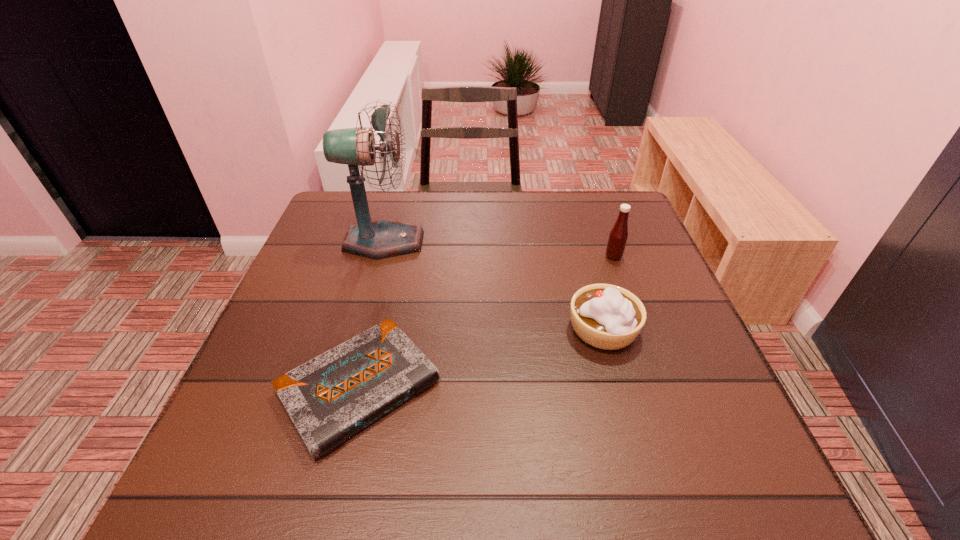
Find the location of a particular element. The height and width of the screenshot is (540, 960). vacant space that satisfies the following two spatial constraints: 1. in front of the Tabasco sauce where the wind blows; 2. on the left side of the fan is located at coordinates (380, 256).

Image resolution: width=960 pixels, height=540 pixels. Find the location of `free spot that satisfies the following two spatial constraints: 1. in front of the tallest object where the wind blows; 2. on the right side of the whipped cream`. free spot that satisfies the following two spatial constraints: 1. in front of the tallest object where the wind blows; 2. on the right side of the whipped cream is located at coordinates (360, 329).

Where is `vacant area that satisfies the following two spatial constraints: 1. in front of the tallest object where the wind blows; 2. on the left side of the third shortest object`? This screenshot has height=540, width=960. vacant area that satisfies the following two spatial constraints: 1. in front of the tallest object where the wind blows; 2. on the left side of the third shortest object is located at coordinates (380, 256).

Find the location of a particular element. This screenshot has width=960, height=540. vacant position in the image that satisfies the following two spatial constraints: 1. in front of the second tallest object where the wind blows; 2. on the left side of the tallest object is located at coordinates (380, 256).

The width and height of the screenshot is (960, 540). I want to click on vacant point that satisfies the following two spatial constraints: 1. in front of the fan where the wind blows; 2. on the right side of the Tabasco sauce, so click(x=380, y=256).

Identify the location of vacant area that satisfies the following two spatial constraints: 1. in front of the second tallest object where the wind blows; 2. on the left side of the tallest object. Image resolution: width=960 pixels, height=540 pixels. [x=380, y=256].